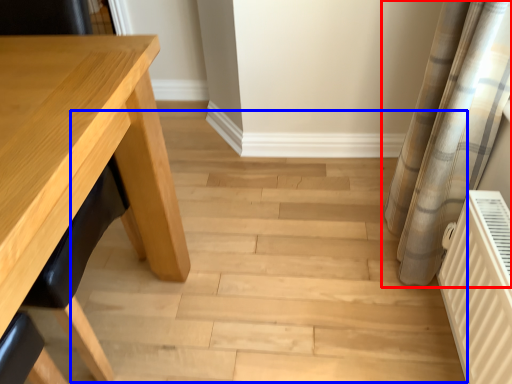
Question: Which point is closer to the camera, curtain (highlighted by a red box) or stair (highlighted by a blue box)?

Choices:
 (A) curtain
 (B) stair

Answer: (A)